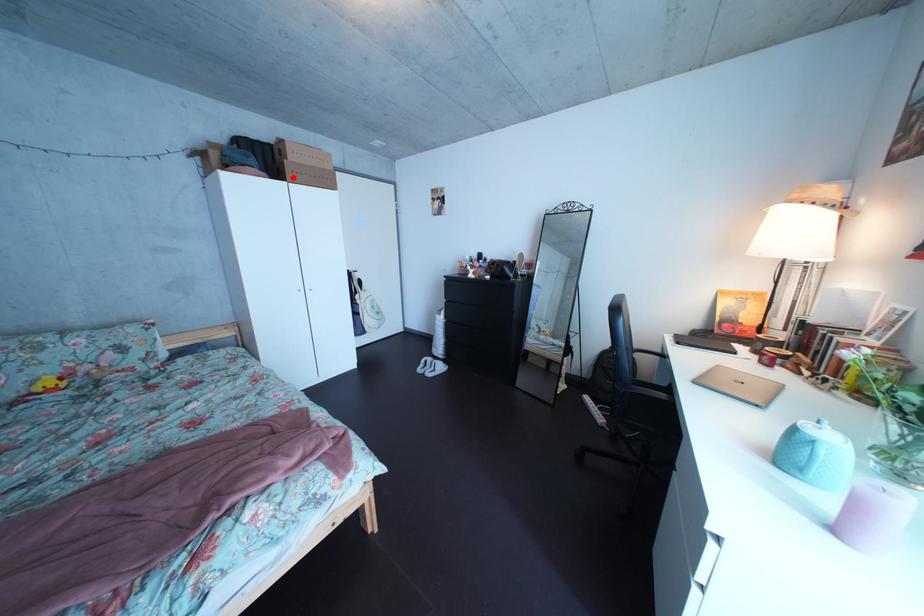
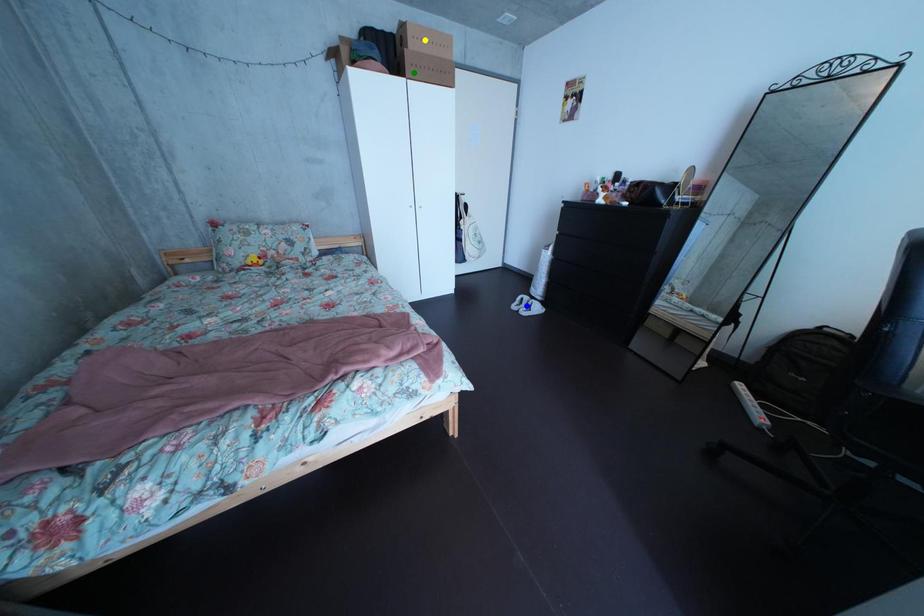
Question: I am providing you with two images of the same scene from different viewpoints. A red point is marked on the first image. You are given multiple points on the second image. In image 2, which mark is for the same physical point as the one in image 1?

Choices:
 (A) blue point
 (B) green point
 (C) yellow point

Answer: (B)